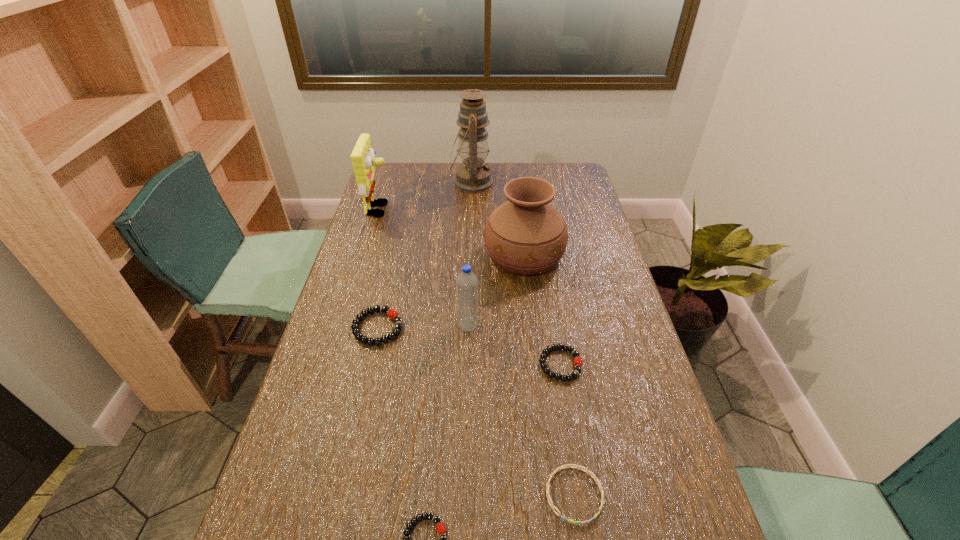
Select which object is the third closest to the urn. Please provide its 2D coordinates. Your answer should be formatted as a tuple, i.e. [(x, y)], where the tuple contains the x and y coordinates of a point satisfying the conditions above.

[(392, 314)]

Point out which bracelet is positioned as the fourth nearest to the sixth nearest object. Please provide its 2D coordinates. Your answer should be formatted as a tuple, i.e. [(x, y)], where the tuple contains the x and y coordinates of a point satisfying the conditions above.

[(441, 529)]

The image size is (960, 540). What are the coordinates of `the closest bracelet to the water bottle` in the screenshot? It's located at (392, 314).

At what (x,y) coordinates should I click in order to perform the action: click on black bracelet that stands as the third closest to the blue water bottle. Please return your answer as a coordinate pair (x, y). This screenshot has width=960, height=540. Looking at the image, I should click on (441, 529).

At what (x,y) coordinates should I click in order to perform the action: click on the second closest black bracelet to the third farthest object. Please return your answer as a coordinate pair (x, y). This screenshot has height=540, width=960. Looking at the image, I should click on (578, 362).

Identify the location of free location that satisfies the following two spatial constraints: 1. on the face of the sponge; 2. on the left side of the sixth nearest object. The image size is (960, 540). (366, 254).